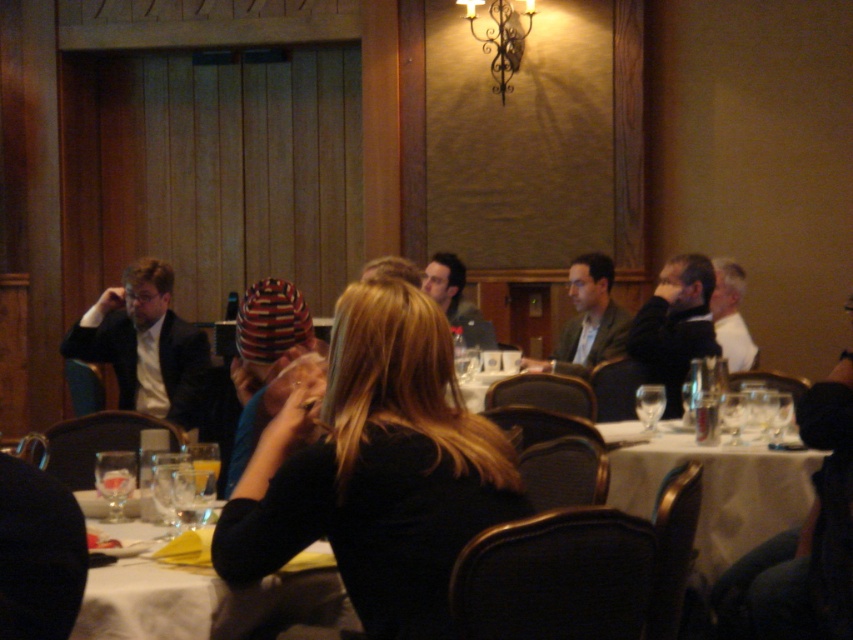
Does white cloth table at center have a greater height compared to white shirt at right?

In fact, white cloth table at center may be shorter than white shirt at right.

Image resolution: width=853 pixels, height=640 pixels. In order to click on white cloth table at center in this screenshot , I will do `click(712, 486)`.

Is white cloth table at center further to camera compared to matte black suit at center?

No, white cloth table at center is in front of matte black suit at center.

Can you confirm if white cloth table at center is positioned to the left of matte black suit at center?

In fact, white cloth table at center is to the right of matte black suit at center.

Identify the location of white cloth table at center. This screenshot has height=640, width=853. (712, 486).

Does dark gray suit at right appear on the left side of clear glass wine glass at center?

Incorrect, dark gray suit at right is not on the left side of clear glass wine glass at center.

Does dark gray suit at right have a larger size compared to clear glass wine glass at center?

Correct, dark gray suit at right is larger in size than clear glass wine glass at center.

You are a GUI agent. You are given a task and a screenshot of the screen. Output one action in this format:
    pyautogui.click(x=<x>, y=<y>)
    Task: Click on the dark gray suit at right
    
    Given the screenshot: What is the action you would take?
    pyautogui.click(x=674, y=324)